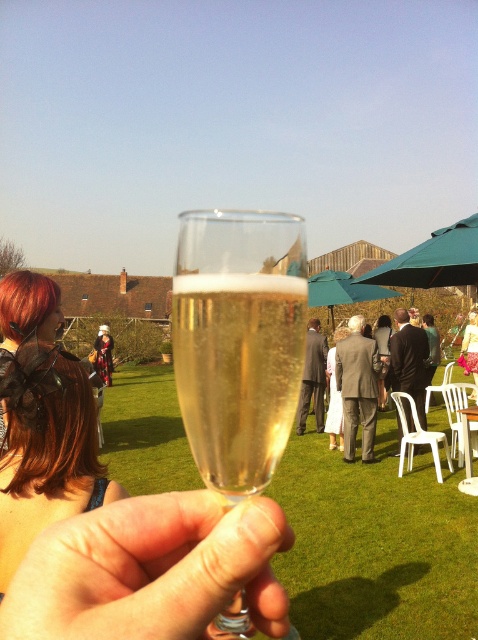
Question: Can you confirm if green grass at center is positioned to the left of teal fabric umbrella at upper right?

Choices:
 (A) yes
 (B) no

Answer: (A)

Question: From the image, what is the correct spatial relationship of green grass at center in relation to teal fabric umbrella at center?

Choices:
 (A) left
 (B) right

Answer: (A)

Question: Among these objects, which one is nearest to the camera?

Choices:
 (A) green grass at center
 (B) silk floral dress at center
 (C) teal fabric umbrella at upper right

Answer: (A)

Question: Is green grass at center smaller than translucent glass at center?

Choices:
 (A) yes
 (B) no

Answer: (B)

Question: Which object is closer to the camera taking this photo?

Choices:
 (A) brown hair at lower left
 (B) teal fabric umbrella at upper right
 (C) translucent glass flute at center
 (D) silk floral dress at center

Answer: (C)

Question: Which of the following is the farthest from the observer?

Choices:
 (A) (326, 456)
 (B) (338, 282)
 (C) (13, 449)

Answer: (B)